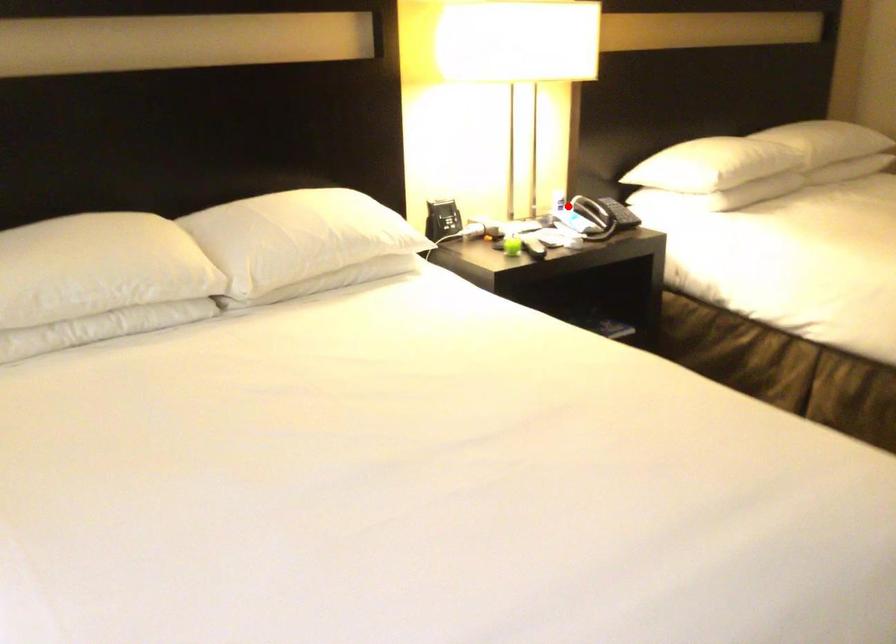
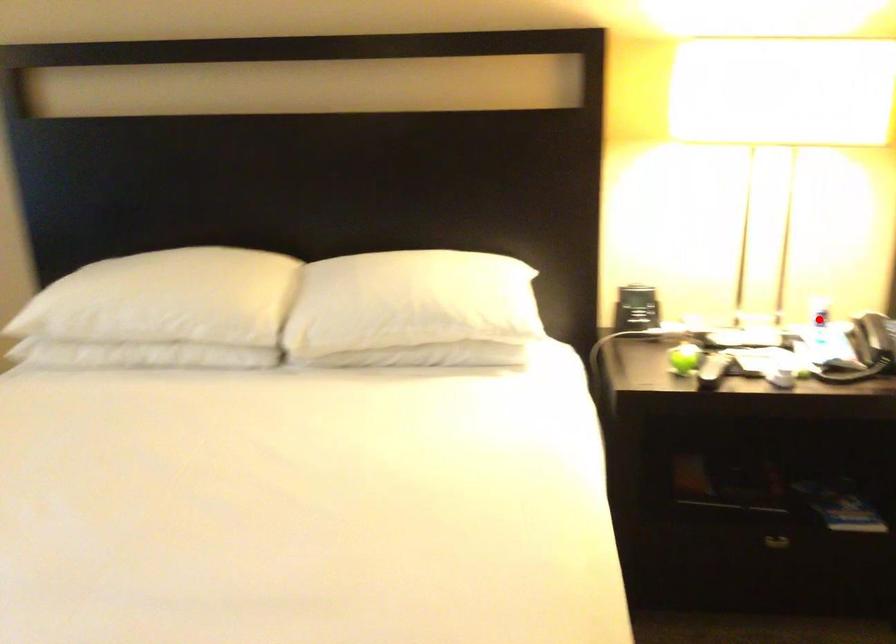
I am providing you with two images of the same scene from different viewpoints. A red point is marked on the first image and another point is marked on the second image. Do the highlighted points in image1 and image2 indicate the same real-world spot?

Yes